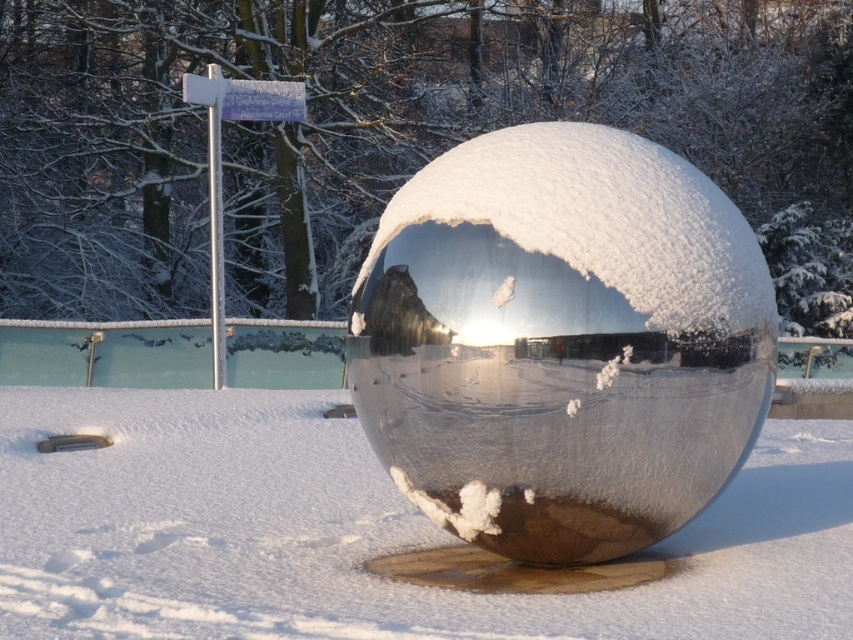
Question: Where is shiny metallic sphere at center located in relation to white fluffy snow at center in the image?

Choices:
 (A) left
 (B) right

Answer: (B)

Question: Does shiny metallic sphere at center appear over white fluffy snow at center?

Choices:
 (A) no
 (B) yes

Answer: (B)

Question: Is shiny metallic sphere at center wider than white fluffy snow at center?

Choices:
 (A) yes
 (B) no

Answer: (B)

Question: Which object is farther from the camera taking this photo?

Choices:
 (A) shiny metallic sphere at center
 (B) white fluffy snow at center

Answer: (A)